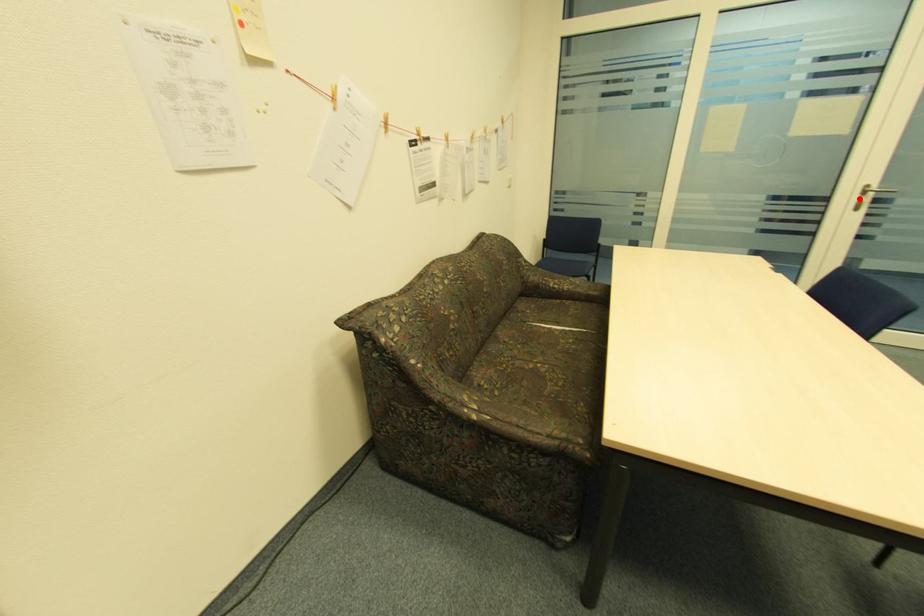
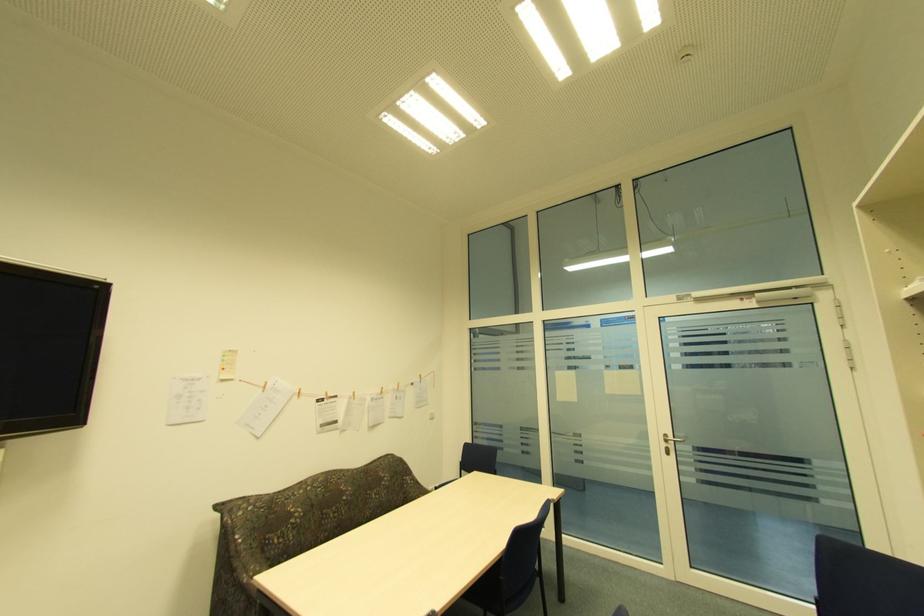
Question: A red point is marked in image1. In image2, is the corresponding 3D point closer to the camera or farther? Reply with the corresponding letter.

Choices:
 (A) The corresponding 3D point is closer.
 (B) The corresponding 3D point is farther.

Answer: (B)